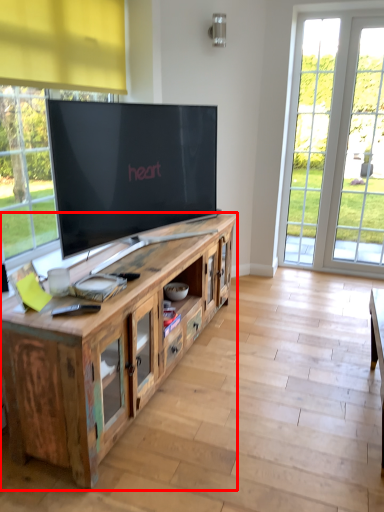
Question: Observing the image, what is the correct spatial positioning of cabinetry (annotated by the red box) in reference to window?

Choices:
 (A) left
 (B) right

Answer: (A)